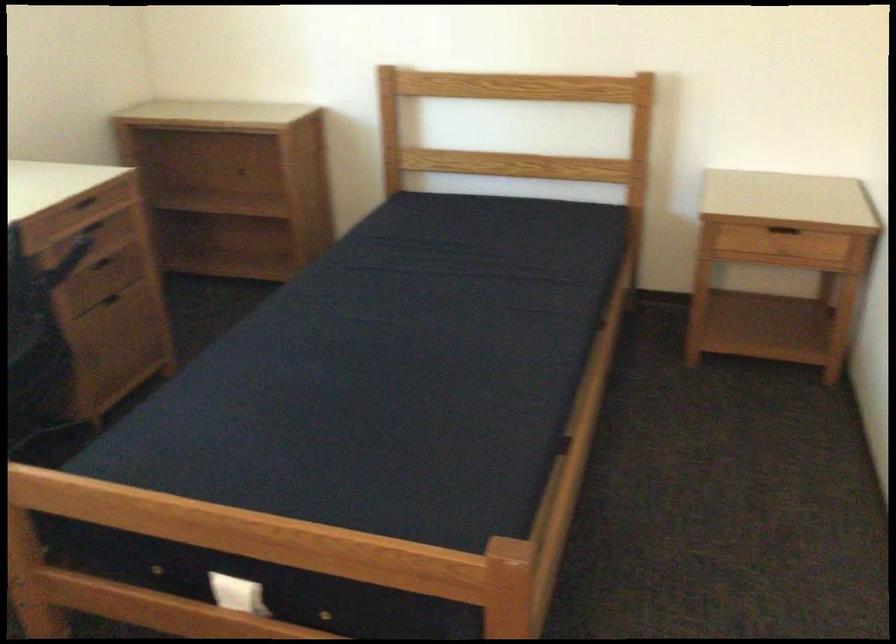
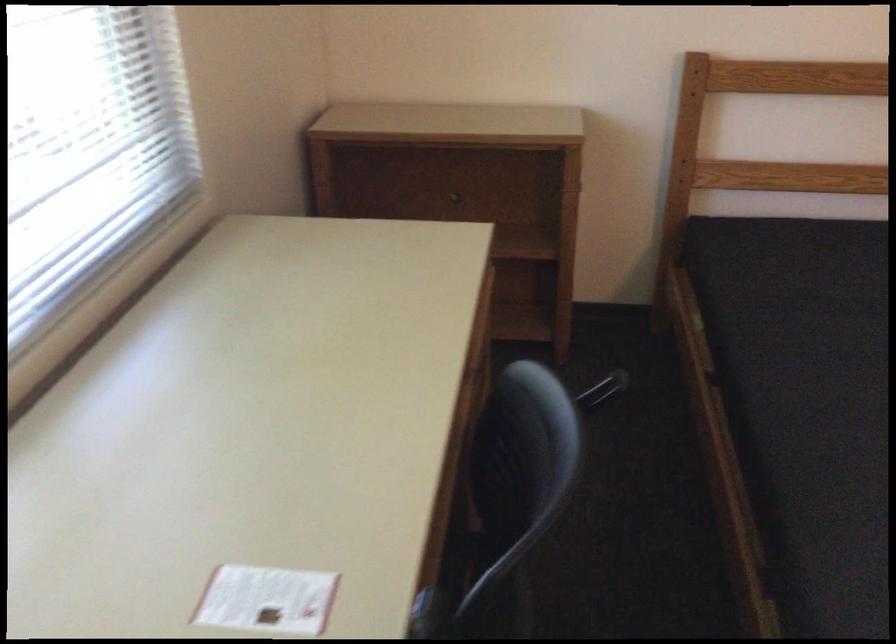
The images are taken continuously from a first-person perspective. In which direction are you moving?

The cameraman walked toward left, forward.